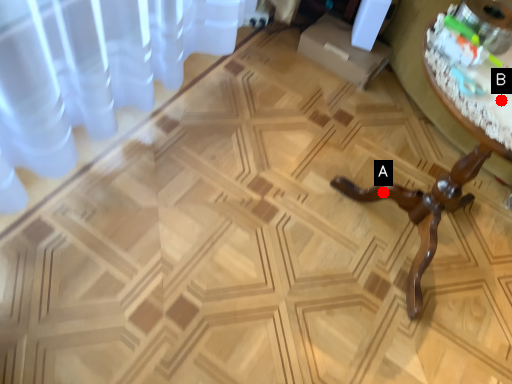
Question: Two points are circled on the image, labeled by A and B beside each circle. Which point is further to the camera?

Choices:
 (A) A is further
 (B) B is further

Answer: (A)